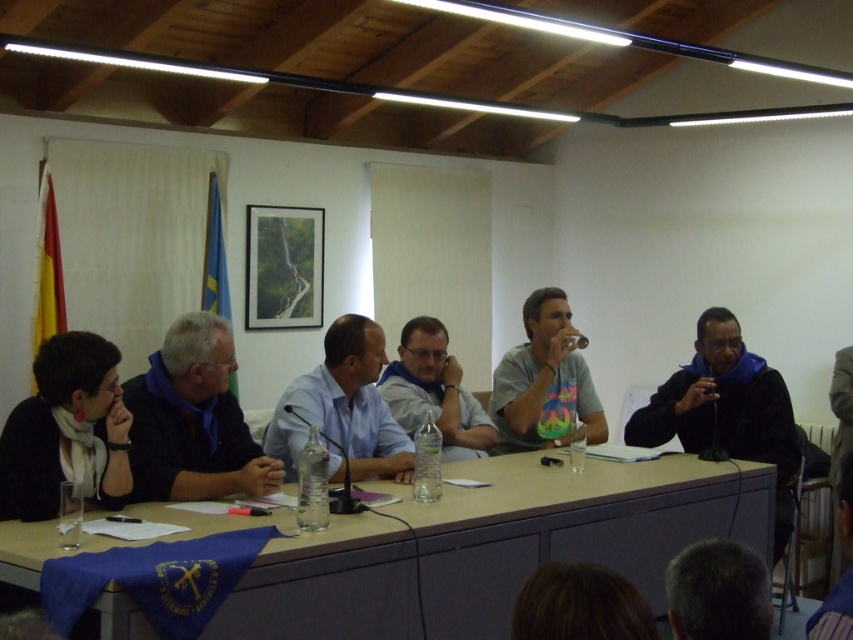
Question: Can you confirm if brown wood table at center is positioned to the left of matte gray t-shirt at center?

Choices:
 (A) no
 (B) yes

Answer: (B)

Question: Which of the following is the closest to the observer?

Choices:
 (A) matte gray t-shirt at center
 (B) light blue shirt at center

Answer: (B)

Question: Which of the following is the farthest from the observer?

Choices:
 (A) [402, 444]
 (B) [41, 545]
 (C) [685, 420]

Answer: (C)

Question: Considering the relative positions of blue fabric at left and light blue shirt at center in the image provided, where is blue fabric at left located with respect to light blue shirt at center?

Choices:
 (A) left
 (B) right

Answer: (A)

Question: Which of the following is the closest to the observer?

Choices:
 (A) brown wood table at center
 (B) light blue shirt at center

Answer: (A)

Question: Is brown wood table at center bigger than matte gray t-shirt at center?

Choices:
 (A) yes
 (B) no

Answer: (A)